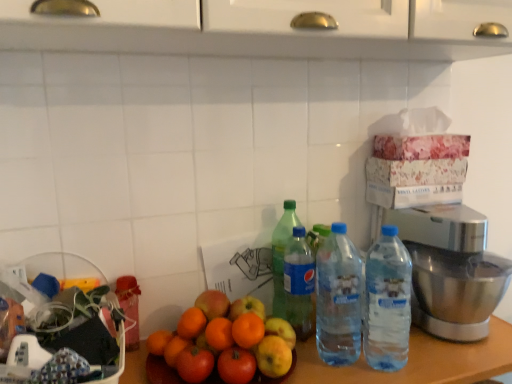
Where is `vacant area that lies to the right of translucent plastic bottle at center, placed as the 2th bottle when sorted from left to right`? The image size is (512, 384). vacant area that lies to the right of translucent plastic bottle at center, placed as the 2th bottle when sorted from left to right is located at coordinates (395, 347).